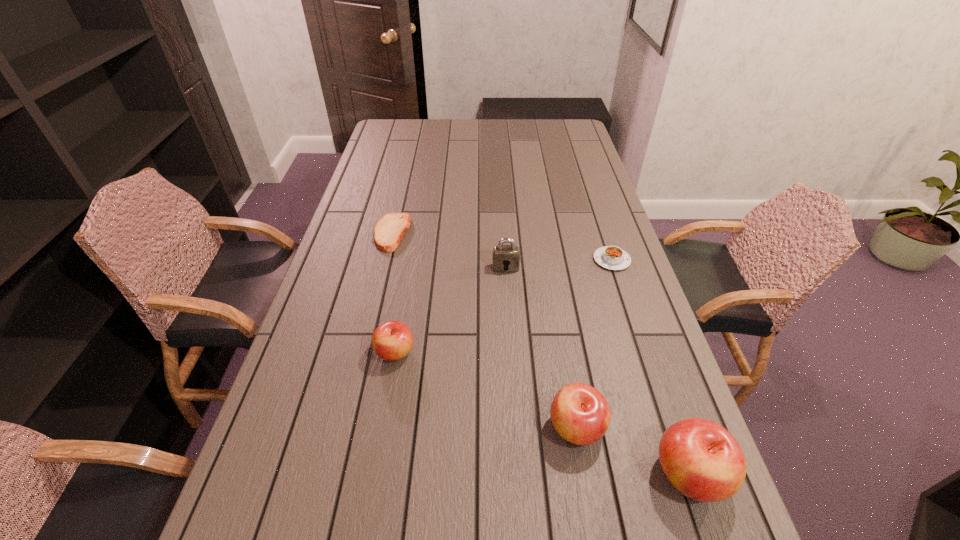
If the aim is uniform spacing by inserting an additional apple among them, please point to a vacant space for this new apple. Please provide its 2D coordinates. Your answer should be formatted as a tuple, i.e. [(x, y)], where the tuple contains the x and y coordinates of a point satisfying the conditions above.

[(479, 387)]